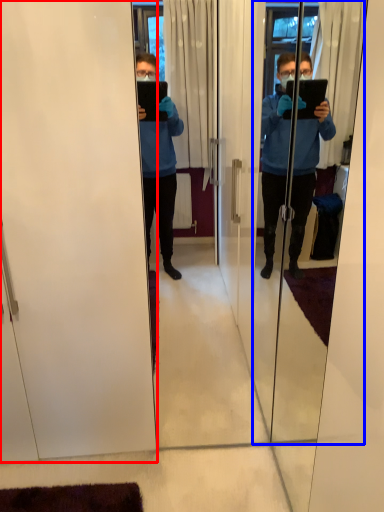
Question: Which of the following is the farthest to the observer, screen door (highlighted by a red box) or screen door (highlighted by a blue box)?

Choices:
 (A) screen door
 (B) screen door

Answer: (A)